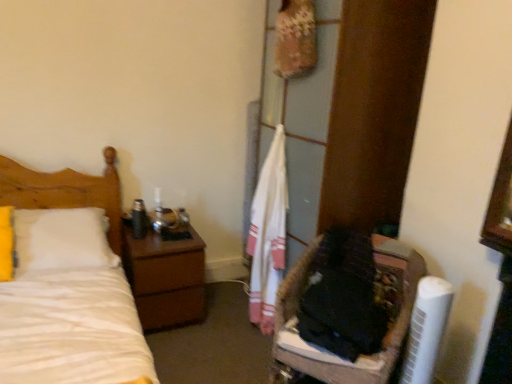
Find the location of a particular element. empty space that is ontop of brown wood nightstand at left (from a real-world perspective) is located at coordinates (167, 234).